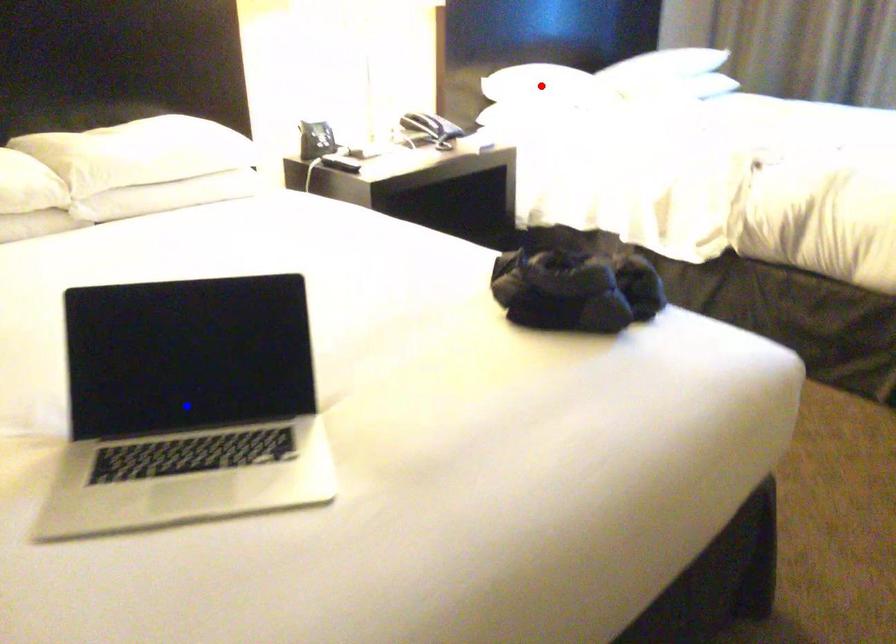
Question: Two points are marked on the image. Which point is closer to the camera?

Choices:
 (A) Blue point is closer.
 (B) Red point is closer.

Answer: (A)